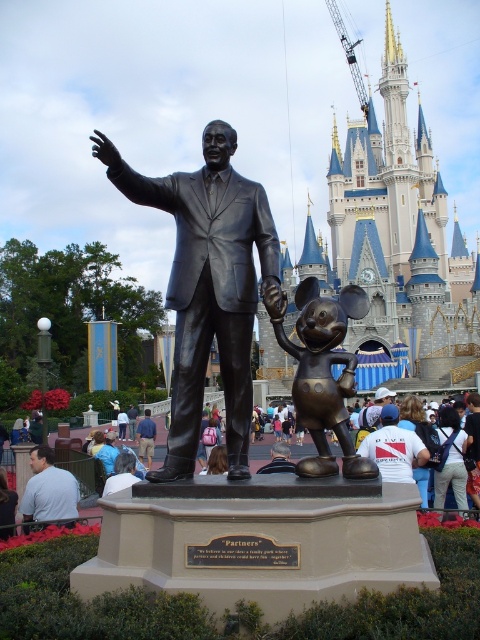
Describe the element at coordinates (207, 285) in the screenshot. I see `bronze statue at center` at that location.

Does point (183, 400) come closer to viewer compared to point (72, 484)?

That is True.

This screenshot has width=480, height=640. I want to click on bronze statue at center, so click(x=207, y=285).

The width and height of the screenshot is (480, 640). Find the location of `gray shirt at lower left`. gray shirt at lower left is located at coordinates (48, 490).

This screenshot has height=640, width=480. In order to click on gray shirt at lower left in this screenshot , I will do `click(48, 490)`.

Between point (252, 296) and point (154, 433), which one is positioned in front?

Point (252, 296)

Is bronze statue at center thinner than blue shirt at lower left?

No, bronze statue at center is not thinner than blue shirt at lower left.

Where is `bronze statue at center`? The height and width of the screenshot is (640, 480). bronze statue at center is located at coordinates (207, 285).

Where is `bronze statue at center`? The image size is (480, 640). bronze statue at center is located at coordinates (207, 285).